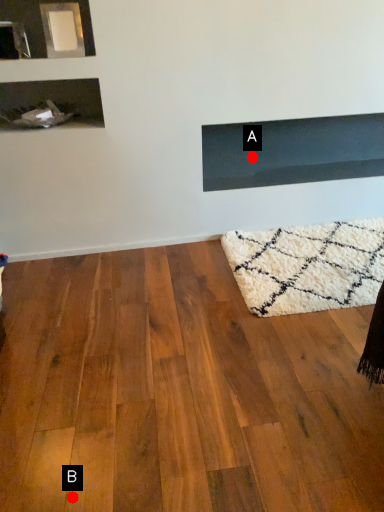
Question: Two points are circled on the image, labeled by A and B beside each circle. Which point is farther to the camera?

Choices:
 (A) A is further
 (B) B is further

Answer: (A)